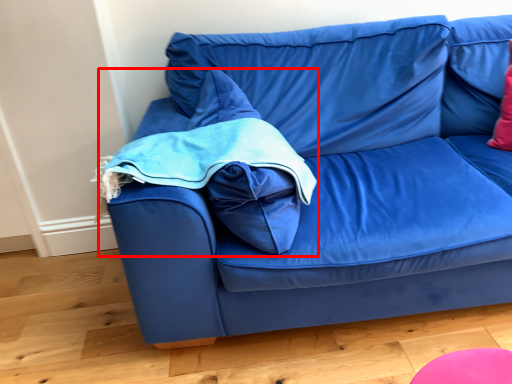
Question: From the image's perspective, considering the relative positions of bean bag chair (annotated by the red box) and studio couch in the image provided, where is bean bag chair (annotated by the red box) located with respect to the staircase?

Choices:
 (A) above
 (B) below

Answer: (B)